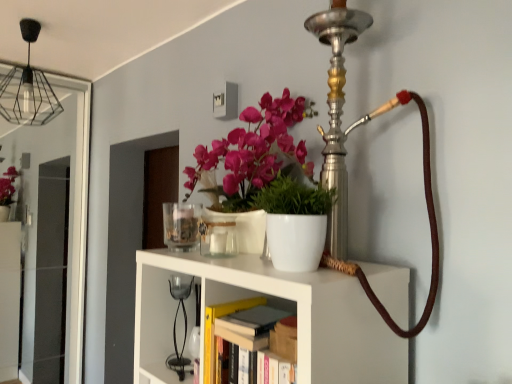
Question: Is white matte shelf at center far from black glass table lamp at center?

Choices:
 (A) no
 (B) yes

Answer: (A)

Question: From a real-world perspective, is white matte shelf at center positioned under black glass table lamp at center based on gravity?

Choices:
 (A) yes
 (B) no

Answer: (A)

Question: Does white matte shelf at center have a greater height compared to black glass table lamp at center?

Choices:
 (A) yes
 (B) no

Answer: (A)

Question: Is white matte shelf at center wider than black glass table lamp at center?

Choices:
 (A) no
 (B) yes

Answer: (B)

Question: Can you confirm if white matte shelf at center is smaller than black glass table lamp at center?

Choices:
 (A) no
 (B) yes

Answer: (A)

Question: From a real-world perspective, is hardcover book at center, positioned as the first book in front-to-back order, positioned above or below hardcover book at center, which is the third book in front-to-back order?

Choices:
 (A) below
 (B) above

Answer: (A)

Question: Considering the positions of hardcover book at center, arranged as the third book when viewed from the back, and hardcover book at center, which is the third book in front-to-back order, in the image, is hardcover book at center, arranged as the third book when viewed from the back, taller or shorter than hardcover book at center, which is the third book in front-to-back order,?

Choices:
 (A) short
 (B) tall

Answer: (A)

Question: Is hardcover book at center, arranged as the third book when viewed from the back, wider or thinner than hardcover book at center, which is the 1th book from back to front?

Choices:
 (A) thin
 (B) wide

Answer: (A)

Question: Is hardcover book at center, arranged as the third book when viewed from the back, inside or outside of hardcover book at center, which is the third book in front-to-back order?

Choices:
 (A) inside
 (B) outside

Answer: (B)

Question: From the image's perspective, is transparent glass door at left located above or below matte black light bulb at upper left?

Choices:
 (A) below
 (B) above

Answer: (A)

Question: Is transparent glass door at left inside the boundaries of matte black light bulb at upper left, or outside?

Choices:
 (A) outside
 (B) inside

Answer: (A)

Question: Does point (49, 74) appear closer or farther from the camera than point (36, 120)?

Choices:
 (A) closer
 (B) farther

Answer: (B)

Question: Relative to matte black light bulb at upper left, is transparent glass door at left in front or behind?

Choices:
 (A) behind
 (B) front

Answer: (A)

Question: Looking at the image, does hardcover book at center, arranged as the third book when viewed from the back, seem bigger or smaller compared to matte black light bulb at upper left?

Choices:
 (A) small
 (B) big

Answer: (A)

Question: In terms of height, does hardcover book at center, arranged as the third book when viewed from the back, look taller or shorter compared to matte black light bulb at upper left?

Choices:
 (A) tall
 (B) short

Answer: (B)